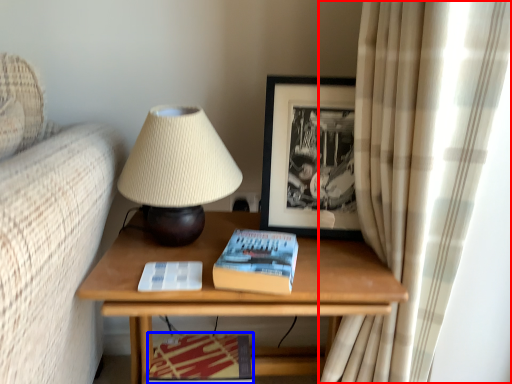
Question: Which of the following is the farthest to the observer, curtain (highlighted by a red box) or magazine (highlighted by a blue box)?

Choices:
 (A) curtain
 (B) magazine

Answer: (B)